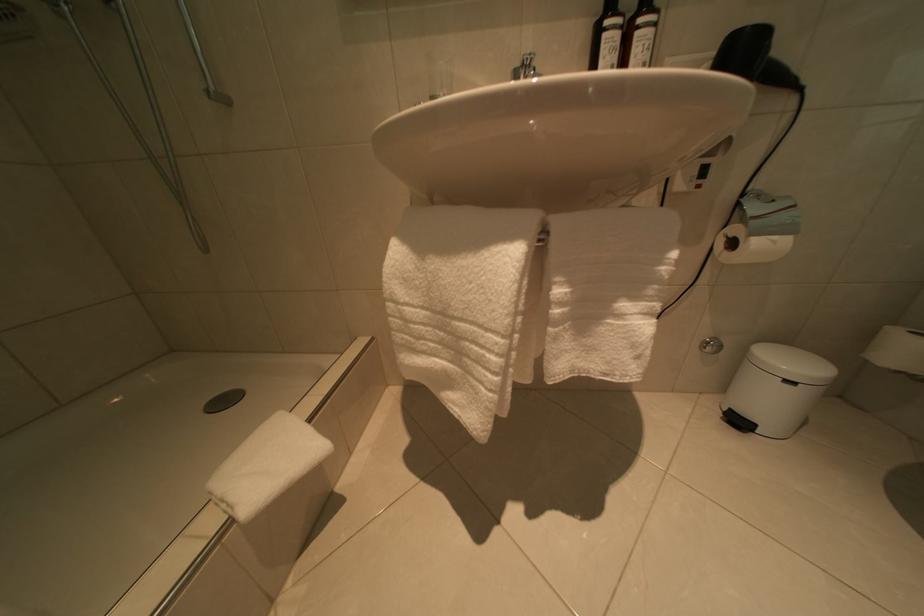
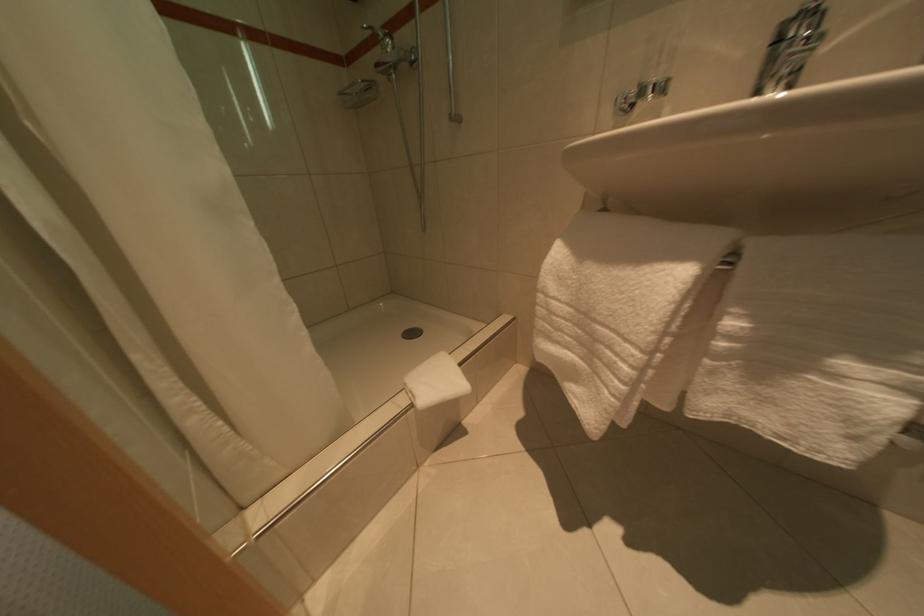
Question: The camera is either moving clockwise (left) or counter-clockwise (right) around the object. The first image is from the beginning of the video and the second image is from the end. Is the camera moving left or right when shooting the video?

Choices:
 (A) Left
 (B) Right

Answer: (B)